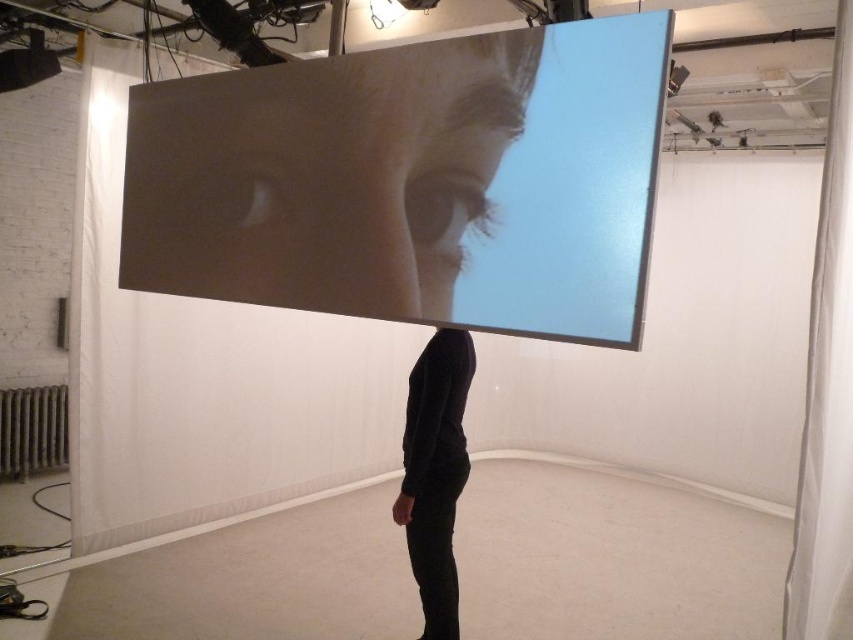
Question: Is smooth skin at upper center to the right of black matte shirt at center from the viewer's perspective?

Choices:
 (A) no
 (B) yes

Answer: (A)

Question: Where is smooth skin at upper center located in relation to black matte shirt at center in the image?

Choices:
 (A) above
 (B) below

Answer: (A)

Question: Can you confirm if smooth skin at upper center is positioned below black matte shirt at center?

Choices:
 (A) no
 (B) yes

Answer: (A)

Question: Among these objects, which one is nearest to the camera?

Choices:
 (A) black matte shirt at center
 (B) smooth skin at upper center

Answer: (B)

Question: Among these points, which one is nearest to the camera?

Choices:
 (A) (450, 374)
 (B) (254, 228)

Answer: (B)

Question: Which of the following is the closest to the observer?

Choices:
 (A) black matte shirt at center
 (B) smooth skin at upper center

Answer: (B)